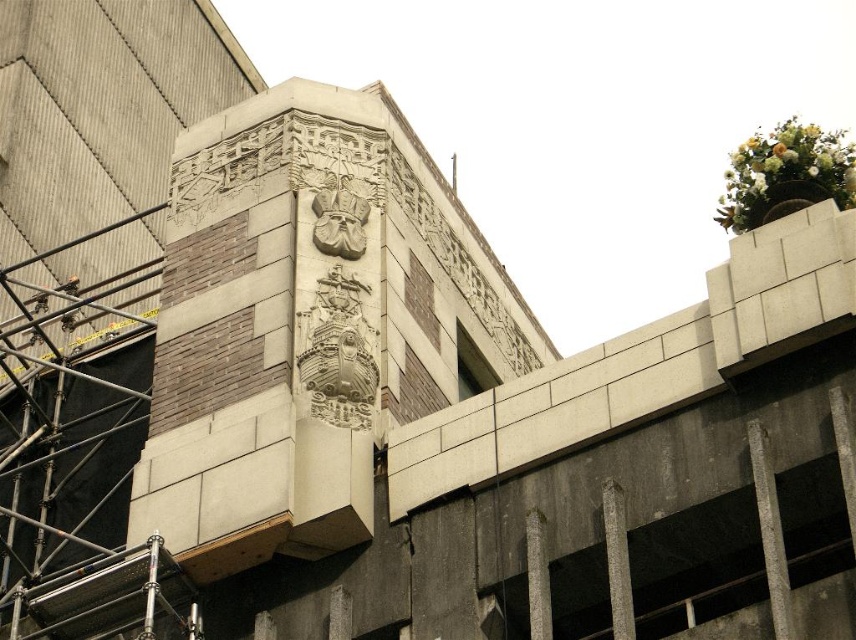
Question: Among these points, which one is nearest to the camera?

Choices:
 (A) (623, 508)
 (B) (530, 625)
 (C) (742, 164)

Answer: (B)

Question: Which point is farther from the camera taking this photo?

Choices:
 (A) (627, 612)
 (B) (815, 198)

Answer: (B)

Question: Can you confirm if white floral bouquet at upper right is positioned to the left of gray stone pillar at center?

Choices:
 (A) no
 (B) yes

Answer: (A)

Question: Does white floral bouquet at upper right have a larger size compared to gray stone pillar at center?

Choices:
 (A) no
 (B) yes

Answer: (B)

Question: Is the position of white floral bouquet at upper right less distant than that of smooth concrete pillar at center?

Choices:
 (A) no
 (B) yes

Answer: (A)

Question: Which of the following is the farthest from the observer?

Choices:
 (A) (541, 515)
 (B) (609, 480)

Answer: (A)